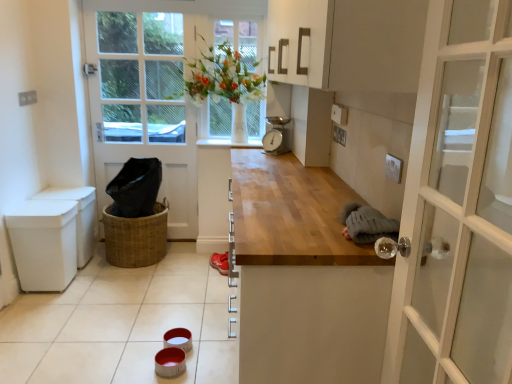
Question: Is white plastic bin at left surrounding white glossy tile at lower center?

Choices:
 (A) yes
 (B) no

Answer: (B)

Question: From a real-world perspective, is white plastic bin at left under white glossy tile at lower center?

Choices:
 (A) no
 (B) yes

Answer: (A)

Question: Can you confirm if white plastic bin at left is shorter than white glossy tile at lower center?

Choices:
 (A) no
 (B) yes

Answer: (A)

Question: Is white plastic bin at left positioned beyond the bounds of white glossy tile at lower center?

Choices:
 (A) yes
 (B) no

Answer: (A)

Question: Considering the relative positions of white plastic bin at left and white glossy tile at lower center in the image provided, is white plastic bin at left in front of white glossy tile at lower center?

Choices:
 (A) yes
 (B) no

Answer: (B)

Question: Considering the positions of white plastic bin at left and woven brown basket at lower left in the image, is white plastic bin at left taller or shorter than woven brown basket at lower left?

Choices:
 (A) tall
 (B) short

Answer: (A)

Question: Is white plastic bin at left wider or thinner than woven brown basket at lower left?

Choices:
 (A) wide
 (B) thin

Answer: (B)

Question: From the image's perspective, is white plastic bin at left positioned above or below woven brown basket at lower left?

Choices:
 (A) above
 (B) below

Answer: (A)

Question: Considering their positions, is white plastic bin at left located in front of or behind woven brown basket at lower left?

Choices:
 (A) front
 (B) behind

Answer: (A)

Question: From the image's perspective, is metallic gray scale at upper center positioned above or below white plastic bin at left?

Choices:
 (A) above
 (B) below

Answer: (A)

Question: In terms of size, does metallic gray scale at upper center appear bigger or smaller than white plastic bin at left?

Choices:
 (A) big
 (B) small

Answer: (B)

Question: From their relative heights in the image, would you say metallic gray scale at upper center is taller or shorter than white plastic bin at left?

Choices:
 (A) short
 (B) tall

Answer: (A)

Question: Is metallic gray scale at upper center to the left or to the right of white plastic bin at left in the image?

Choices:
 (A) right
 (B) left

Answer: (A)

Question: Does point (144, 367) appear closer or farther from the camera than point (122, 253)?

Choices:
 (A) closer
 (B) farther

Answer: (A)

Question: Would you say white glossy tile at lower center is inside or outside woven brown basket at lower left?

Choices:
 (A) inside
 (B) outside

Answer: (B)